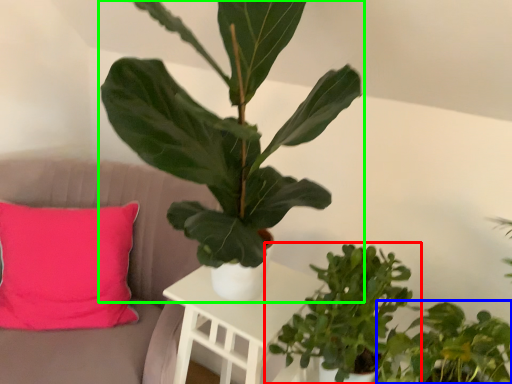
Question: Estimate the real-world distances between objects in this image. Which object is farther from houseplant (highlighted by a red box), houseplant (highlighted by a blue box) or houseplant (highlighted by a green box)?

Choices:
 (A) houseplant
 (B) houseplant

Answer: (B)